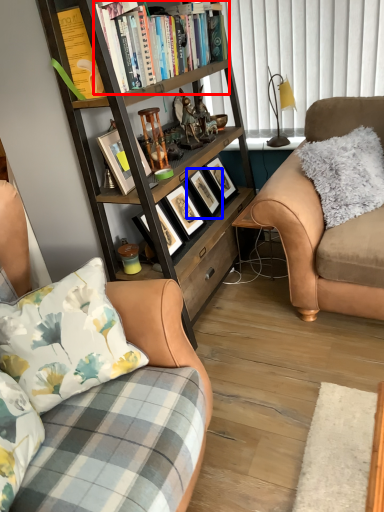
Question: Which object appears farthest to the camera in this image, book (highlighted by a red box) or picture frame (highlighted by a blue box)?

Choices:
 (A) book
 (B) picture frame

Answer: (B)